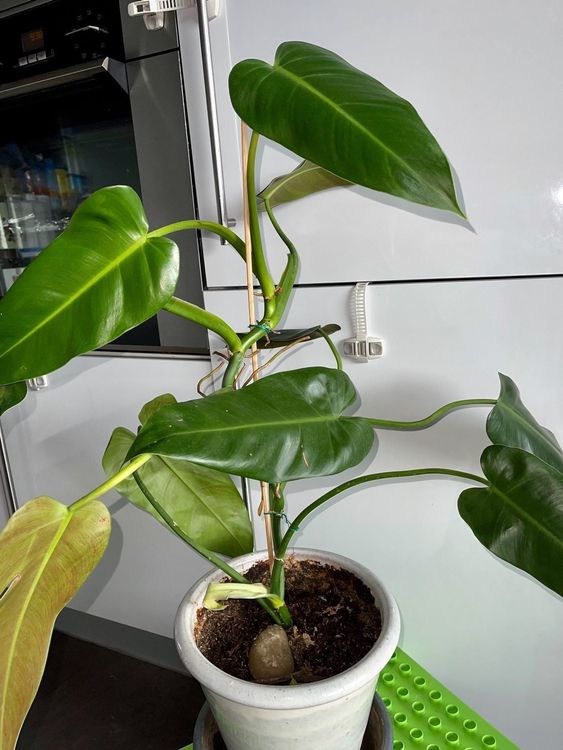
This screenshot has width=563, height=750. Find the location of `stand`. stand is located at coordinates (449, 744).